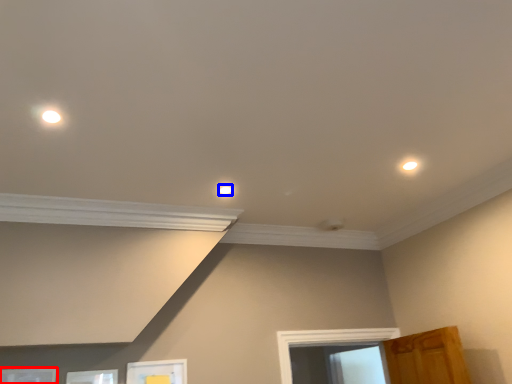
Question: Among these objects, which one is farthest to the camera, picture frame (highlighted by a red box) or dot (highlighted by a blue box)?

Choices:
 (A) picture frame
 (B) dot

Answer: (B)